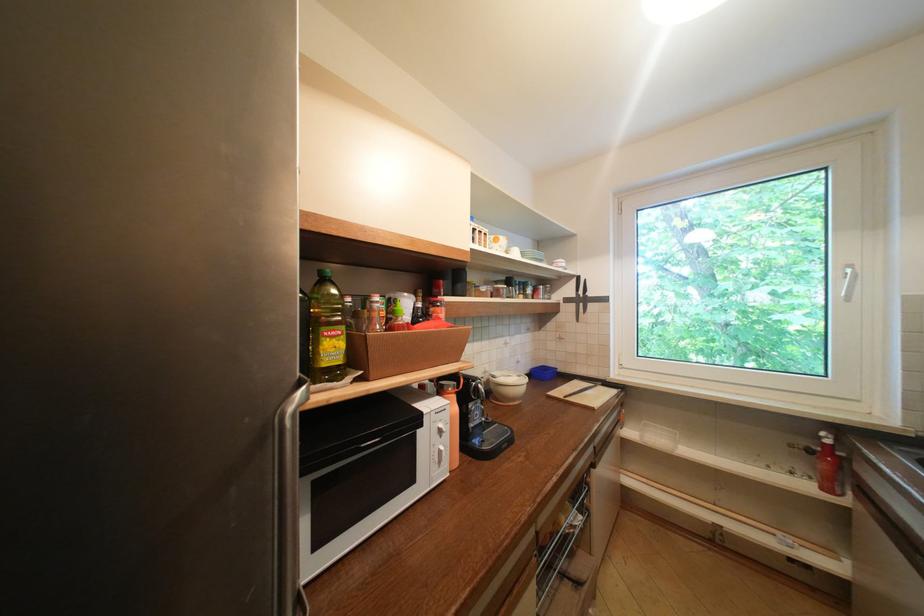
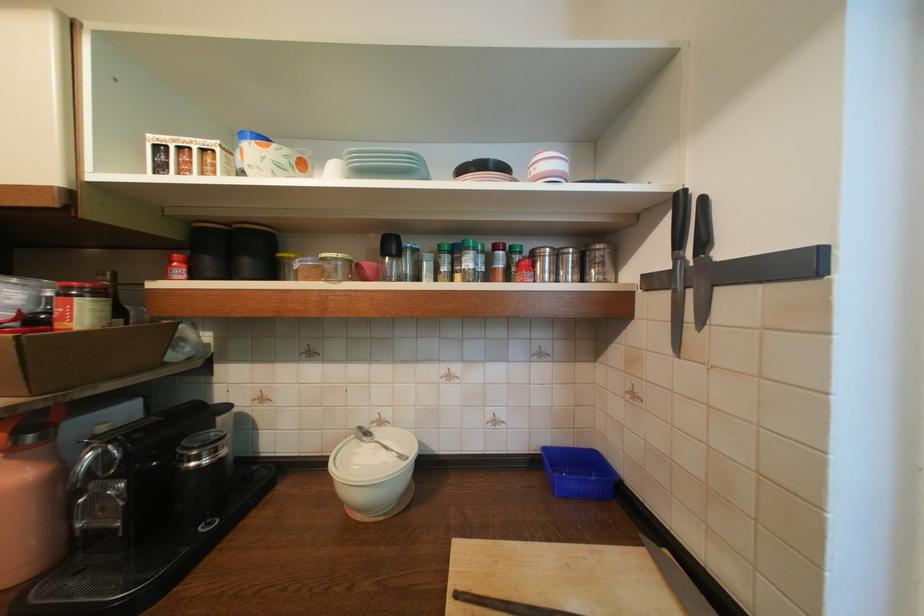
Locate, in the second image, the point that corresponds to point 586,296 in the first image.

(686, 261)